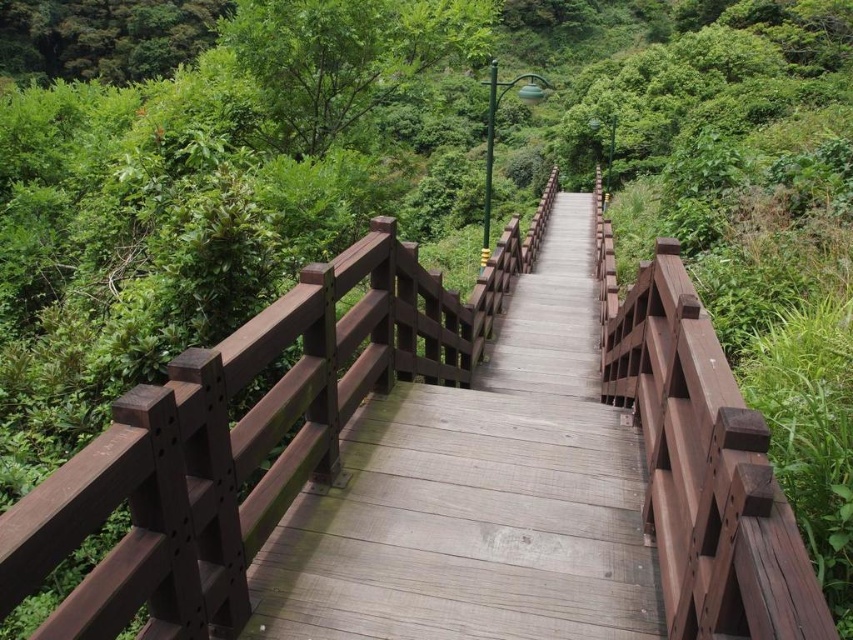
You are a hiker standing on the wooden walkway and want to cross the wooden bridge at center. You notice a green leafy tree at upper left nearby. Which one is taller?

The green leafy tree at upper left is taller than the wooden bridge at center.

You are a hiker standing on the wooden walkway and want to know which tree is wider between the green leafy tree at upper center and the green leafy tree at upper left. Which one is wider?

The green leafy tree at upper left is wider than the green leafy tree at upper center because the description states that the green leafy tree at upper center is narrower.

You are standing on the wooden walkway in the forest and see a point marked at coordinates (479, 488). Is this point located on the wooden bridge at center?

Yes, the point (479, 488) is on the wooden bridge at center as stated in the objects description.